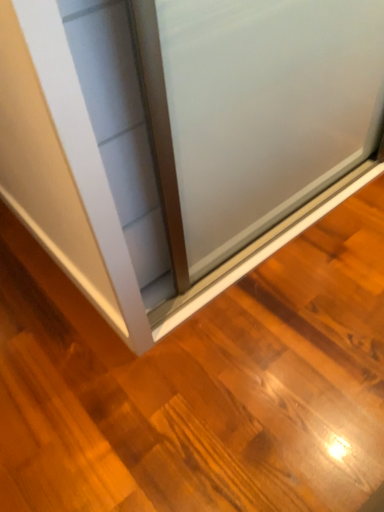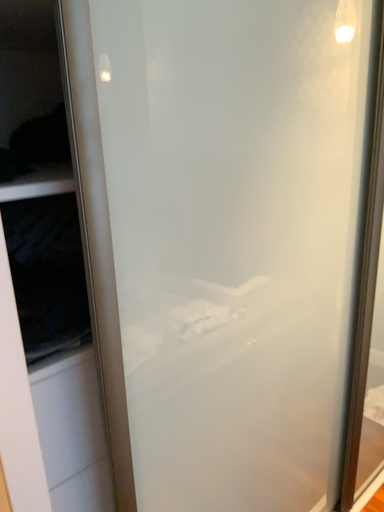
Question: How did the camera likely rotate when shooting the video?

Choices:
 (A) rotated upward
 (B) rotated downward

Answer: (A)